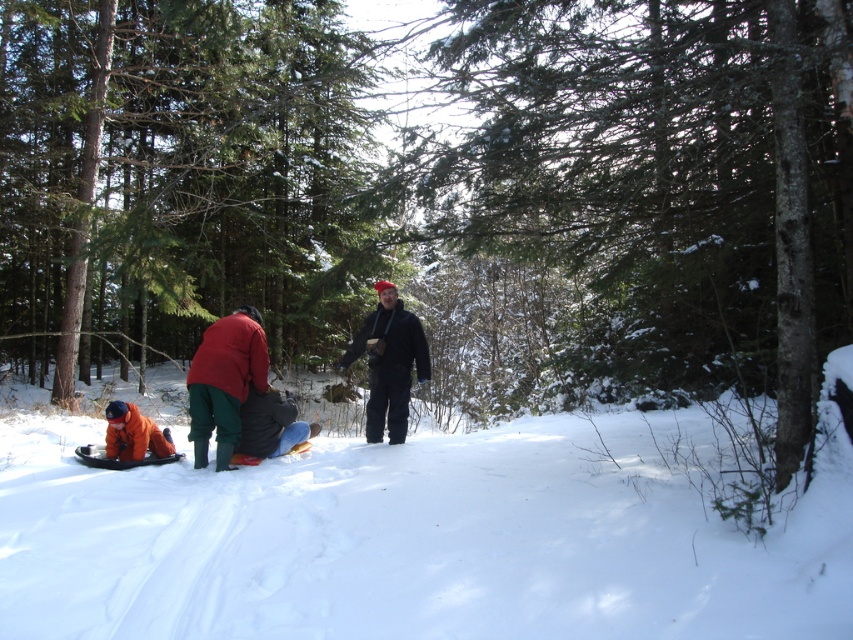
This screenshot has height=640, width=853. Describe the element at coordinates (416, 538) in the screenshot. I see `white fluffy snow at center` at that location.

Is point (630, 442) positioned behind point (378, 376)?

No, it is in front of (378, 376).

Find the location of `white fluffy snow at center`. white fluffy snow at center is located at coordinates (416, 538).

Measure the distance between white fluffy snow at center and matte red jacket at center.

white fluffy snow at center and matte red jacket at center are 10.94 feet apart.

Between white fluffy snow at center and matte red jacket at center, which one is positioned lower?

white fluffy snow at center is below.

You are a GUI agent. You are given a task and a screenshot of the screen. Output one action in this format:
    pyautogui.click(x=<x>, y=<y>)
    Task: Click on the white fluffy snow at center
    The image size is (853, 640).
    Given the screenshot: What is the action you would take?
    pyautogui.click(x=416, y=538)

Find the location of a particular element. white fluffy snow at center is located at coordinates coord(416,538).

Consider the image. Is orange fleece jacket at lower left to the right of orange fabric snowshoe at lower left from the viewer's perspective?

In fact, orange fleece jacket at lower left is to the left of orange fabric snowshoe at lower left.

Can you confirm if orange fleece jacket at lower left is smaller than orange fabric snowshoe at lower left?

Actually, orange fleece jacket at lower left might be larger than orange fabric snowshoe at lower left.

Between point (120, 433) and point (79, 456), which one is positioned behind?

Positioned behind is point (120, 433).

The image size is (853, 640). In order to click on orange fleece jacket at lower left in this screenshot , I will do `click(132, 435)`.